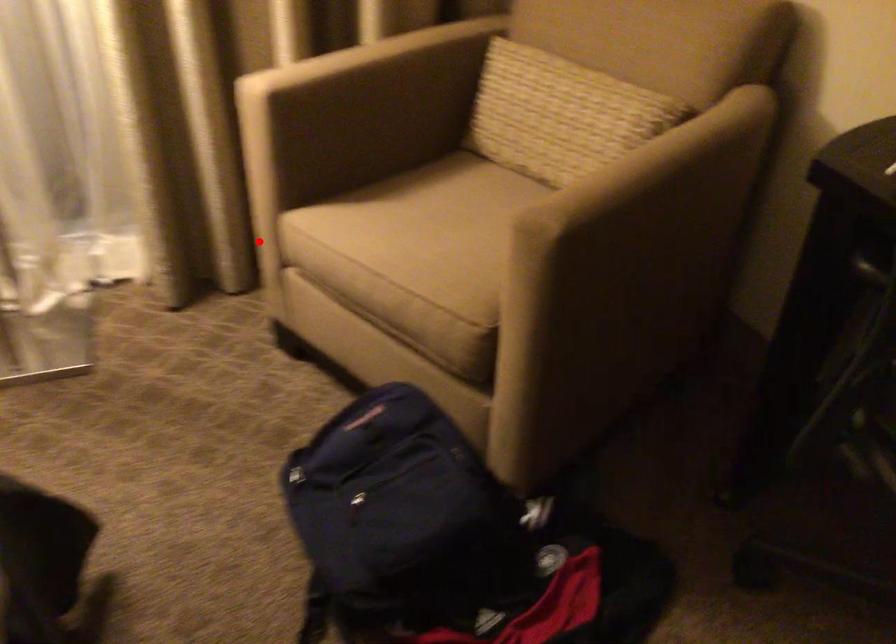
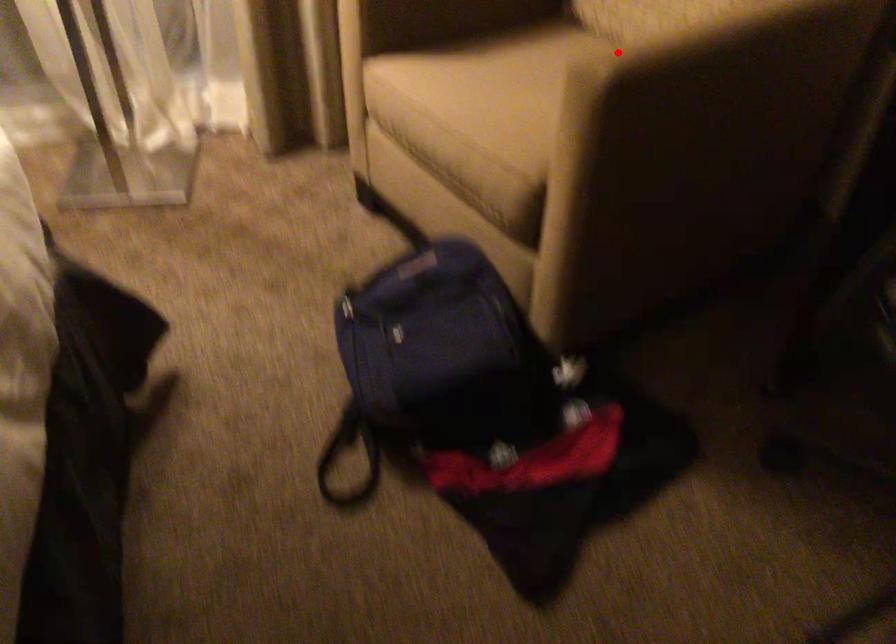
I am providing you with two images of the same scene from different viewpoints. A red point is marked on the first image and another point is marked on the second image. Are the points marked in image1 and image2 representing the same 3D position?

No